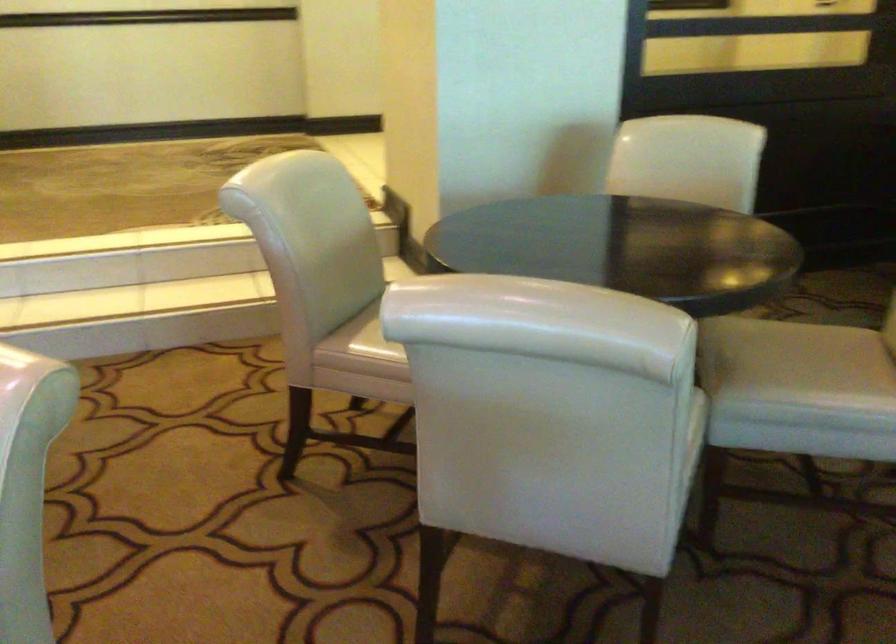
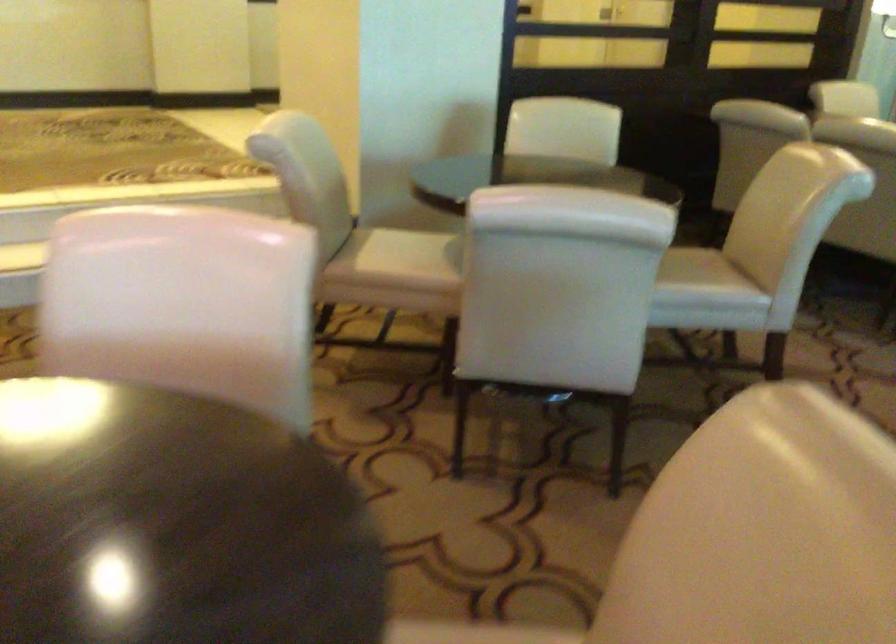
Which direction would the cameraman need to move to produce the second image?

The cameraman moved toward left, backward.